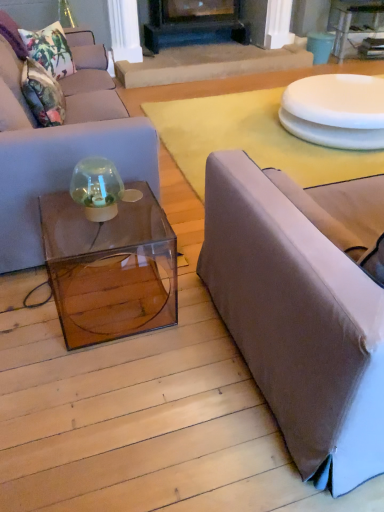
Question: From the image's perspective, would you say black matte fireplace at center is positioned over floral fabric pillow at upper left, positioned as the 2th pillow in bottom-to-top order?

Choices:
 (A) yes
 (B) no

Answer: (A)

Question: Is black matte fireplace at center shorter than floral fabric pillow at upper left, which is the first pillow from top to bottom?

Choices:
 (A) no
 (B) yes

Answer: (A)

Question: From a real-world perspective, is black matte fireplace at center physically below floral fabric pillow at upper left, positioned as the 2th pillow in bottom-to-top order?

Choices:
 (A) yes
 (B) no

Answer: (A)

Question: From a real-world perspective, is black matte fireplace at center on floral fabric pillow at upper left, which is the first pillow from top to bottom?

Choices:
 (A) no
 (B) yes

Answer: (A)

Question: Is black matte fireplace at center not inside floral fabric pillow at upper left, positioned as the 2th pillow in bottom-to-top order?

Choices:
 (A) no
 (B) yes

Answer: (B)

Question: Is floral fabric pillow at upper left, which is the first pillow from top to bottom, surrounded by black matte fireplace at center?

Choices:
 (A) no
 (B) yes

Answer: (A)

Question: Considering the relative sizes of matte gray couch at left, which is the second studio couch from right to left, and floral fabric cushion at upper left, marked as the first pillow in a bottom-to-top arrangement, in the image provided, is matte gray couch at left, which is the second studio couch from right to left, smaller than floral fabric cushion at upper left, marked as the first pillow in a bottom-to-top arrangement,?

Choices:
 (A) yes
 (B) no

Answer: (B)

Question: From the image's perspective, does matte gray couch at left, which is the second studio couch from right to left, appear lower than floral fabric cushion at upper left, which is counted as the second pillow, starting from the top?

Choices:
 (A) no
 (B) yes

Answer: (B)

Question: Is matte gray couch at left, positioned as the 1th studio couch in left-to-right order, oriented towards floral fabric cushion at upper left, marked as the first pillow in a bottom-to-top arrangement?

Choices:
 (A) yes
 (B) no

Answer: (A)

Question: Is matte gray couch at left, positioned as the 1th studio couch in left-to-right order, in contact with floral fabric cushion at upper left, marked as the first pillow in a bottom-to-top arrangement?

Choices:
 (A) no
 (B) yes

Answer: (A)

Question: From a real-world perspective, is matte gray couch at left, which is the second studio couch from right to left, under floral fabric cushion at upper left, marked as the first pillow in a bottom-to-top arrangement?

Choices:
 (A) no
 (B) yes

Answer: (B)

Question: Considering the relative sizes of matte gray couch at left, positioned as the 1th studio couch in left-to-right order, and floral fabric cushion at upper left, marked as the first pillow in a bottom-to-top arrangement, in the image provided, is matte gray couch at left, positioned as the 1th studio couch in left-to-right order, bigger than floral fabric cushion at upper left, marked as the first pillow in a bottom-to-top arrangement,?

Choices:
 (A) yes
 (B) no

Answer: (A)

Question: Is matte gray couch at left, which is the second studio couch from right to left, bigger than black matte fireplace at center?

Choices:
 (A) yes
 (B) no

Answer: (A)